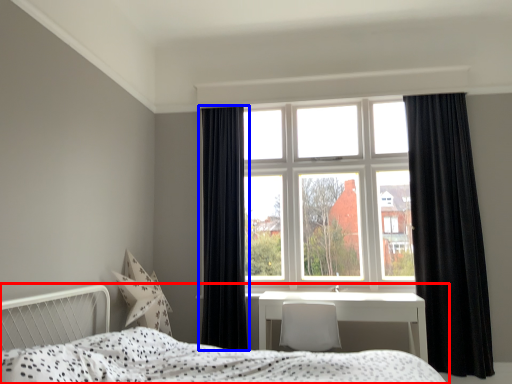
Question: Among these objects, which one is nearest to the camera, bed (highlighted by a red box) or curtain (highlighted by a blue box)?

Choices:
 (A) bed
 (B) curtain

Answer: (A)